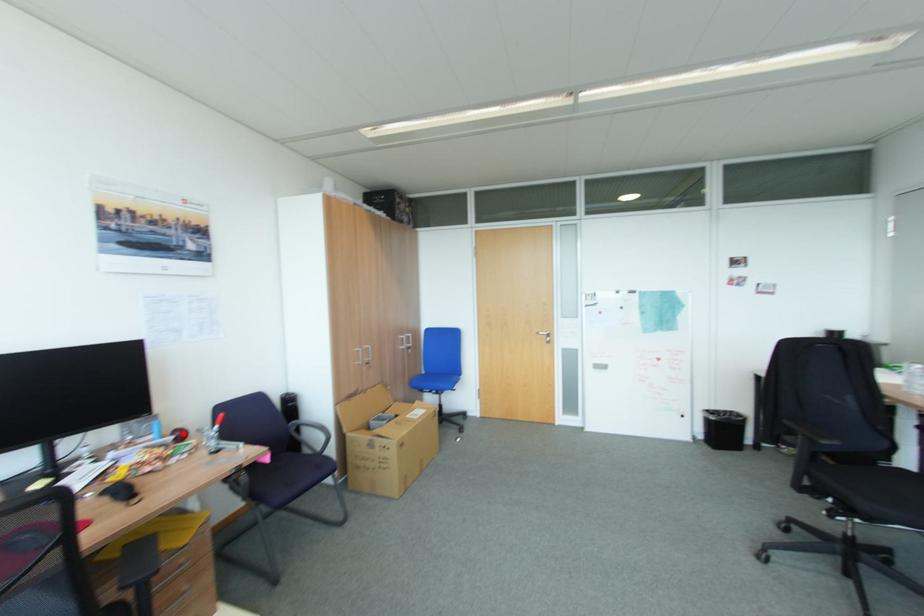
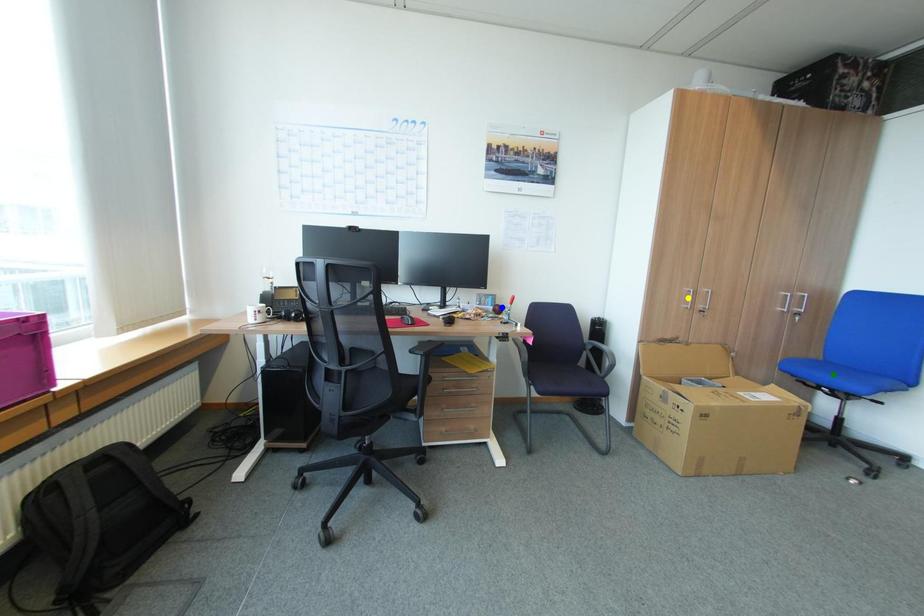
Question: I am providing you with two images of the same scene from different viewpoints. A red point is marked on the first image. You are given multiple points on the second image. Can you choose the point in image 2 that corresponds to the point in image 1?

Choices:
 (A) yellow point
 (B) blue point
 (C) green point

Answer: (B)